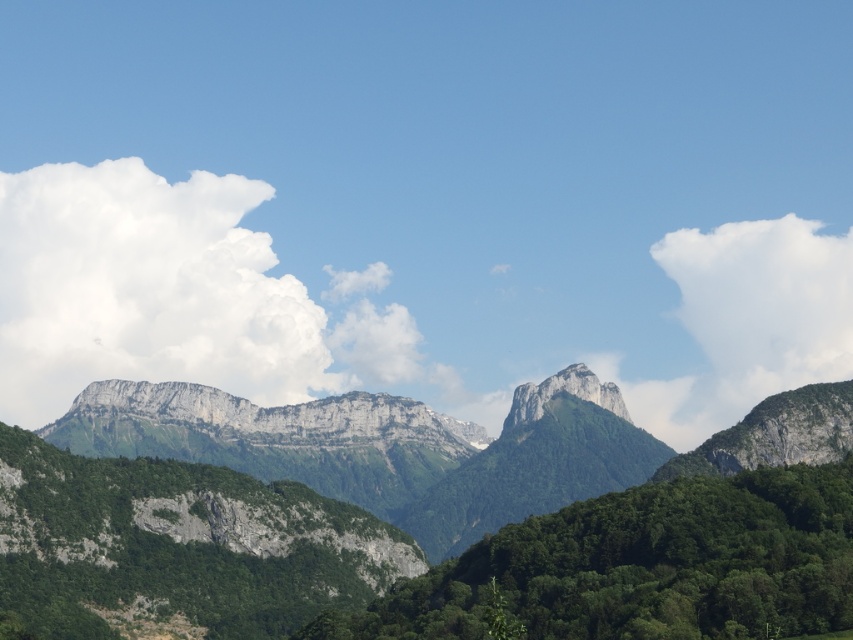
You are an airplane passenger looking out the window and see the white fluffy cloud at upper left and the white fluffy cloud at upper right. Which cloud is closer to you?

The white fluffy cloud at upper left is closer to the viewer than the white fluffy cloud at upper right.

You are a hiker planning to take a photo of the green rocky mountain at center and the white fluffy cloud at upper right. Which object will appear closer to the camera in your photo?

The green rocky mountain at center will appear closer to the camera because it is positioned in front of the white fluffy cloud at upper right.

You are a hiker planning to take a photo of the green rocky mountain at center and the white fluffy cloud at upper right. From your current position, which object is higher in the sky?

The white fluffy cloud at upper right is higher in the sky than the green rocky mountain at center because it is positioned above it.